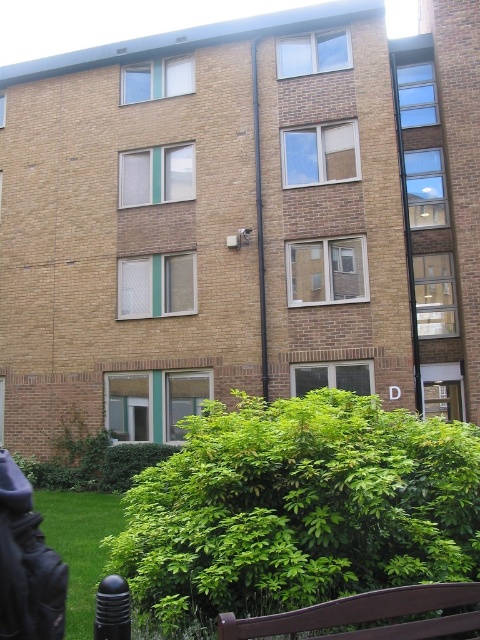
Can you confirm if green leafy bush at center is positioned below brown wooden bench at lower center?

No.

Which of these two, green leafy bush at center or brown wooden bench at lower center, stands taller?

green leafy bush at center

Who is more distant from viewer, (x=239, y=454) or (x=446, y=600)?

Positioned behind is point (x=239, y=454).

Locate an element on the screen. green leafy bush at center is located at coordinates (299, 508).